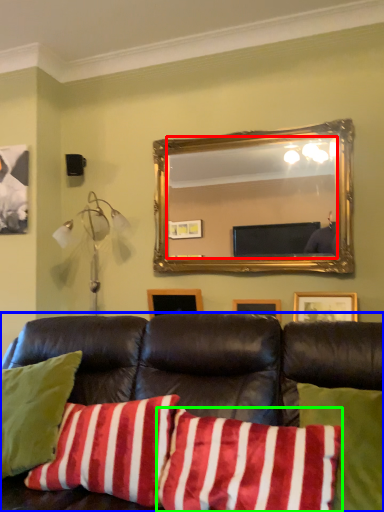
Question: Considering the real-world distances, which object is farthest from mirror (highlighted by a red box)? studio couch (highlighted by a blue box) or pillow (highlighted by a green box)?

Choices:
 (A) studio couch
 (B) pillow

Answer: (B)